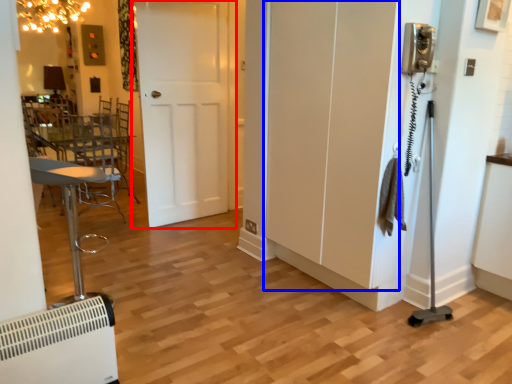
Question: Which of the following is the closest to the observer, door (highlighted by a red box) or screen door (highlighted by a blue box)?

Choices:
 (A) door
 (B) screen door

Answer: (B)